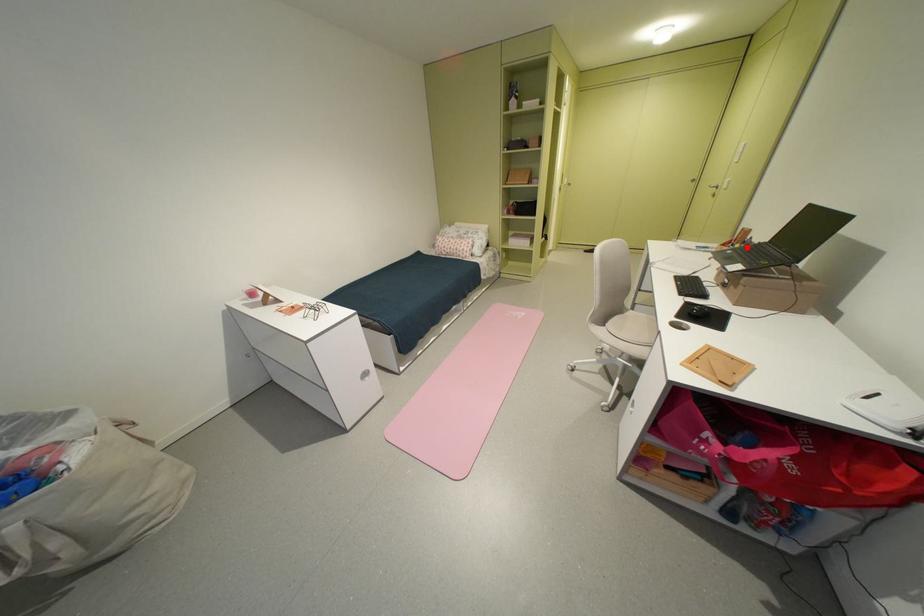
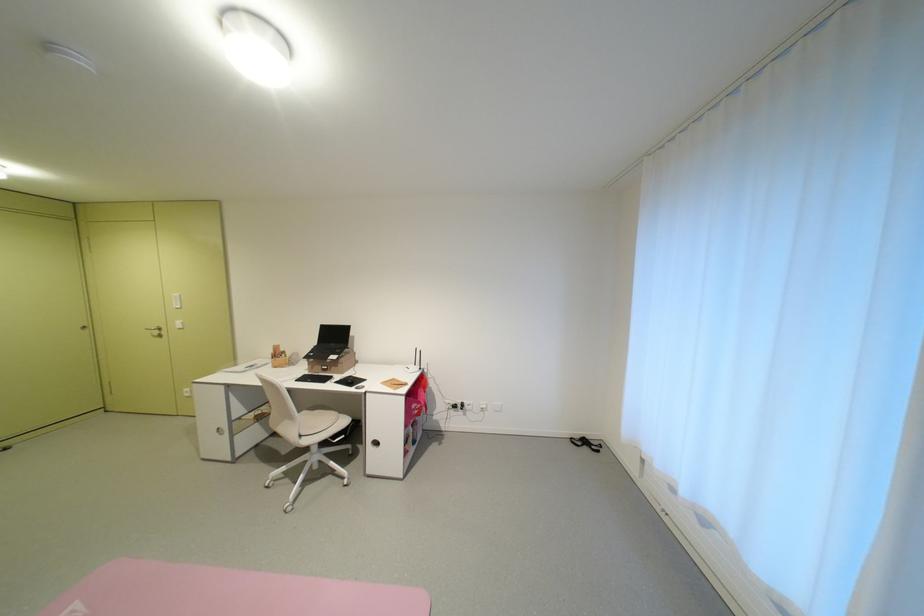
The point at the highlighted location is marked in the first image. Where is the corresponding point in the second image?

(293, 357)